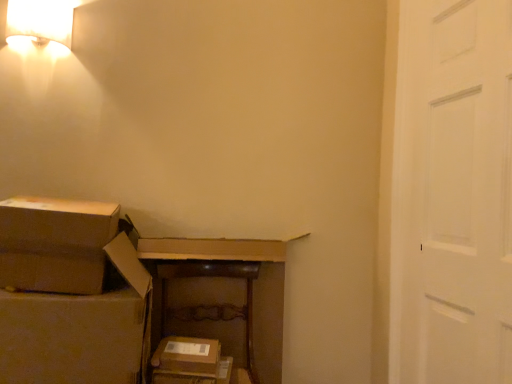
The width and height of the screenshot is (512, 384). What do you see at coordinates (221, 297) in the screenshot?
I see `brown wooden dresser at center` at bounding box center [221, 297].

You are a GUI agent. You are given a task and a screenshot of the screen. Output one action in this format:
    pyautogui.click(x=<x>, y=<y>)
    Task: Click on the brown cardboard box at left, the first storage box from the left
    
    Given the screenshot: What is the action you would take?
    pyautogui.click(x=81, y=329)

Which of these two, brown cardboard box at left, arranged as the 1th storage box when viewed from the top, or white painted wood door at right, stands taller?

Standing taller between the two is white painted wood door at right.

Is brown cardboard box at left, which is counted as the second storage box, starting from the bottom, inside or outside of white painted wood door at right?

brown cardboard box at left, which is counted as the second storage box, starting from the bottom, lies outside white painted wood door at right.

Looking at this image, who is taller, white fabric lampshade at upper left or brown cardboard box at left, which is counted as the second storage box, starting from the bottom?

Standing taller between the two is brown cardboard box at left, which is counted as the second storage box, starting from the bottom.

The image size is (512, 384). In order to click on lamp located on the left of brown cardboard box at left, arranged as the 1th storage box when viewed from the top in this screenshot , I will do `click(40, 22)`.

From a real-world perspective, is white fabric lampshade at upper left above or below brown cardboard box at left, the second storage box positioned from the right?

In terms of real-world spatial position, white fabric lampshade at upper left is above brown cardboard box at left, the second storage box positioned from the right.

How many degrees apart are the facing directions of white fabric lampshade at upper left and brown cardboard box at left, arranged as the 1th storage box when viewed from the top?

The facing directions of white fabric lampshade at upper left and brown cardboard box at left, arranged as the 1th storage box when viewed from the top, are 5.64 degrees apart.

Between brown cardboard box at left, the first storage box from the left, and brown wooden dresser at center, which one appears on the left side from the viewer's perspective?

brown cardboard box at left, the first storage box from the left.

From a real-world perspective, is brown cardboard box at left, arranged as the 1th storage box when viewed from the top, located beneath brown wooden dresser at center?

No, from a real-world perspective, brown cardboard box at left, arranged as the 1th storage box when viewed from the top, is not under brown wooden dresser at center.

Is brown cardboard box at left, the first storage box from the left, not close to brown wooden dresser at center?

No.

Could you tell me if brown cardboard box at lower left is turned towards white fabric lampshade at upper left?

No, brown cardboard box at lower left is not aimed at white fabric lampshade at upper left.

Would you consider brown cardboard box at lower left to be distant from white fabric lampshade at upper left?

Actually, brown cardboard box at lower left and white fabric lampshade at upper left are a little close together.

From the image's perspective, which is above, brown cardboard box at lower left or white fabric lampshade at upper left?

white fabric lampshade at upper left, from the image's perspective.

Can you confirm if brown wooden dresser at center is smaller than white fabric lampshade at upper left?

No.

Is brown wooden dresser at center located outside white fabric lampshade at upper left?

Yes, brown wooden dresser at center is located beyond the bounds of white fabric lampshade at upper left.

Does brown wooden dresser at center lie behind white fabric lampshade at upper left?

That is True.

Which object is positioned more to the right, brown wooden dresser at center or white fabric lampshade at upper left?

Positioned to the right is brown wooden dresser at center.

Which object is thinner, brown cardboard box at left, the second storage box positioned from the right, or brown cardboard box at center, positioned as the first storage box in bottom-to-top order?

brown cardboard box at center, positioned as the first storage box in bottom-to-top order.

Which point is more distant from viewer, (113, 280) or (164, 348)?

The point (164, 348) is behind.

Measure the distance from brown cardboard box at left, the second storage box positioned from the right, to brown cardboard box at center, the first storage box when ordered from right to left.

brown cardboard box at left, the second storage box positioned from the right, and brown cardboard box at center, the first storage box when ordered from right to left, are 10.65 inches apart.

Find the location of a particular element. Image resolution: width=512 pixels, height=384 pixels. door on the right side of brown wooden dresser at center is located at coordinates (452, 194).

Which is in front, point (268, 349) or point (499, 193)?

Positioned in front is point (499, 193).

Which object is more forward, brown wooden dresser at center or white painted wood door at right?

white painted wood door at right.

The image size is (512, 384). I want to click on door that appears in front of the brown cardboard box at left, which is counted as the second storage box, starting from the bottom, so click(452, 194).

This screenshot has width=512, height=384. What are the coordinates of `lamp that is above the brown cardboard box at left, which is counted as the second storage box, starting from the bottom (from the image's perspective)` in the screenshot? It's located at (40, 22).

Looking at the image, which one is located closer to brown cardboard box at lower left, brown wooden dresser at center or brown cardboard box at left, arranged as the 1th storage box when viewed from the top?

brown cardboard box at left, arranged as the 1th storage box when viewed from the top, is positioned closer to the anchor brown cardboard box at lower left.

Considering their positions, is white fabric lampshade at upper left positioned closer to white painted wood door at right than brown cardboard box at center, the first storage box when ordered from right to left?

brown cardboard box at center, the first storage box when ordered from right to left, lies closer to white painted wood door at right than the other object.

Which object lies nearer to the anchor point white fabric lampshade at upper left, brown cardboard box at center, positioned as the first storage box in bottom-to-top order, or brown cardboard box at left, which is counted as the second storage box, starting from the bottom?

Among the two, brown cardboard box at left, which is counted as the second storage box, starting from the bottom, is located nearer to white fabric lampshade at upper left.

Which object lies further to the anchor point white fabric lampshade at upper left, brown wooden dresser at center or white painted wood door at right?

white painted wood door at right lies further to white fabric lampshade at upper left than the other object.

Estimate the real-world distances between objects in this image. Which object is closer to brown cardboard box at center, positioned as the first storage box in bottom-to-top order, white painted wood door at right or brown cardboard box at lower left?

brown cardboard box at lower left is closer to brown cardboard box at center, positioned as the first storage box in bottom-to-top order.

Estimate the real-world distances between objects in this image. Which object is further from brown cardboard box at lower left, brown cardboard box at left, which is counted as the second storage box, starting from the bottom, or brown cardboard box at center, which ranks as the 2th storage box in top-to-bottom order?

Among the two, brown cardboard box at center, which ranks as the 2th storage box in top-to-bottom order, is located further to brown cardboard box at lower left.

Based on their spatial positions, is brown wooden dresser at center or brown cardboard box at center, the first storage box when ordered from right to left, further from white painted wood door at right?

Based on the image, brown cardboard box at center, the first storage box when ordered from right to left, appears to be further to white painted wood door at right.

From the image, which object appears to be farther from brown cardboard box at center, positioned as the first storage box in bottom-to-top order, brown cardboard box at lower left or brown cardboard box at left, which is counted as the second storage box, starting from the bottom?

brown cardboard box at lower left is positioned further to the anchor brown cardboard box at center, positioned as the first storage box in bottom-to-top order.

In order to click on dresser between brown cardboard box at left, the second storage box positioned from the right, and white painted wood door at right from left to right in this screenshot , I will do `click(221, 297)`.

Where is `dresser between white fabric lampshade at upper left and white painted wood door at right in the horizontal direction`? This screenshot has height=384, width=512. dresser between white fabric lampshade at upper left and white painted wood door at right in the horizontal direction is located at coordinates (221, 297).

This screenshot has width=512, height=384. I want to click on dresser situated between brown cardboard box at lower left and white painted wood door at right from left to right, so click(x=221, y=297).

At what (x,y) coordinates should I click in order to perform the action: click on storage box between brown cardboard box at lower left and brown cardboard box at center, the first storage box when ordered from right to left. Please return your answer as a coordinate pair (x, y). The image size is (512, 384). Looking at the image, I should click on (81, 329).